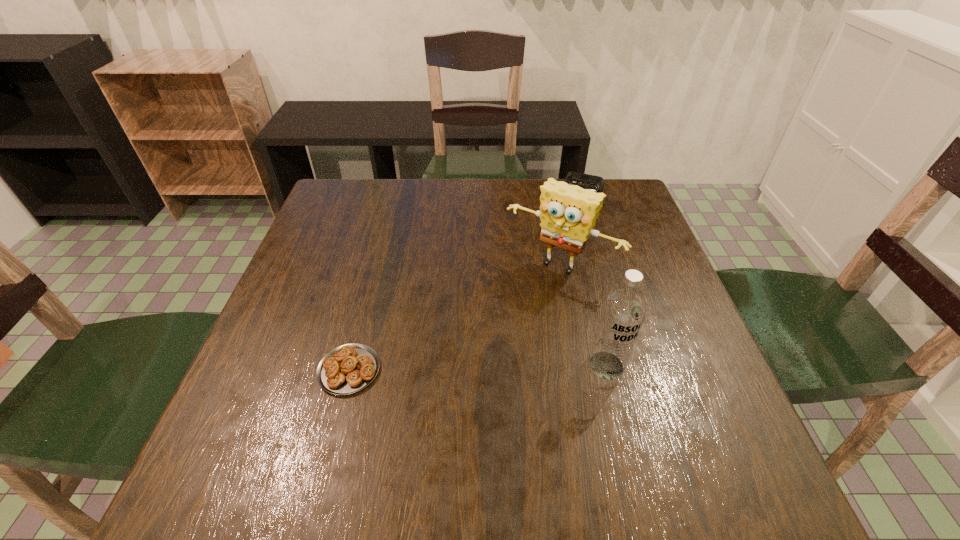
Find the location of a particular element. empty space between the vodka and the farthest object is located at coordinates (594, 276).

This screenshot has height=540, width=960. What are the coordinates of `vacant area that lies between the vodka and the leftmost object` in the screenshot? It's located at [478, 368].

The width and height of the screenshot is (960, 540). Identify the location of empty space that is in between the vodka and the pastry. (478, 368).

You are a GUI agent. You are given a task and a screenshot of the screen. Output one action in this format:
    pyautogui.click(x=<x>, y=<y>)
    Task: Click on the free space between the vodka and the farthest object
    
    Given the screenshot: What is the action you would take?
    pyautogui.click(x=594, y=276)

Point out which object is positioned as the third nearest to the leftmost object. Please provide its 2D coordinates. Your answer should be formatted as a tuple, i.e. [(x, y)], where the tuple contains the x and y coordinates of a point satisfying the conditions above.

[(585, 181)]

This screenshot has height=540, width=960. I want to click on object that stands as the third closest to the pastry, so click(585, 181).

Find the location of a particular element. The width and height of the screenshot is (960, 540). blank space that satisfies the following two spatial constraints: 1. on the back side of the farthest object; 2. on the left side of the sponge is located at coordinates (544, 188).